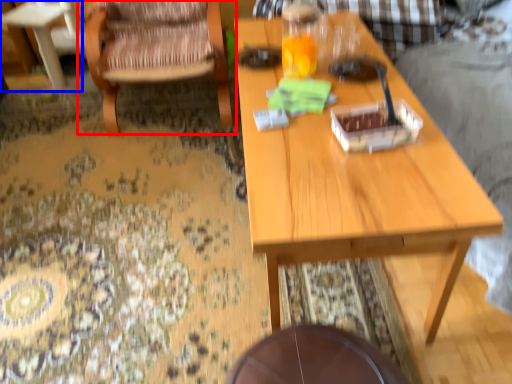
Question: Which object is further to the camera taking this photo, chair (highlighted by a red box) or coffee table (highlighted by a blue box)?

Choices:
 (A) chair
 (B) coffee table

Answer: (B)